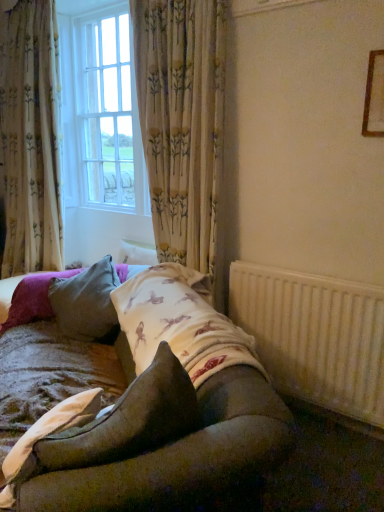
Describe the element at coordinates (30, 138) in the screenshot. This screenshot has width=384, height=512. I see `floral fabric curtain at left, the first curtain positioned from the left` at that location.

At what (x,y) coordinates should I click in order to perform the action: click on velvet gray pillow at center, which is the 1th pillow from back to front. Please return your answer as a coordinate pair (x, y). This screenshot has height=512, width=384. Looking at the image, I should click on (87, 303).

Locate an element on the screen. Image resolution: width=384 pixels, height=512 pixels. textured beige quilt at lower left is located at coordinates (49, 375).

You are a GUI agent. You are given a task and a screenshot of the screen. Output one action in this format:
    pyautogui.click(x=<x>, y=<y>)
    Task: Click on the wooden frame at upper right
    The width and height of the screenshot is (384, 512).
    Given the screenshot: What is the action you would take?
    pyautogui.click(x=374, y=96)

Describe the element at coordinates (315, 336) in the screenshot. Image resolution: width=384 pixels, height=512 pixels. I see `white textured radiator at lower right` at that location.

Where is `floral fabric curtain at left, arranged as the second curtain when viewed from the right`? The image size is (384, 512). floral fabric curtain at left, arranged as the second curtain when viewed from the right is located at coordinates (30, 138).

Considering the sizes of velvet gray pillow at center, which is the 1th pillow from back to front, and textured beige quilt at lower left in the image, is velvet gray pillow at center, which is the 1th pillow from back to front, bigger or smaller than textured beige quilt at lower left?

Clearly, velvet gray pillow at center, which is the 1th pillow from back to front, is larger in size than textured beige quilt at lower left.

Considering the relative positions of velvet gray pillow at center, which ranks as the second pillow in front-to-back order, and textured beige quilt at lower left in the image provided, is velvet gray pillow at center, which ranks as the second pillow in front-to-back order, behind textured beige quilt at lower left?

Yes, velvet gray pillow at center, which ranks as the second pillow in front-to-back order, is further from the camera.

Is velvet gray pillow at center, which ranks as the second pillow in front-to-back order, wider or thinner than textured beige quilt at lower left?

velvet gray pillow at center, which ranks as the second pillow in front-to-back order, is wider than textured beige quilt at lower left.

Relative to white textured radiator at lower right, is textured beige quilt at lower left in front or behind?

Clearly, textured beige quilt at lower left is in front of white textured radiator at lower right.

Is the surface of textured beige quilt at lower left in direct contact with white textured radiator at lower right?

textured beige quilt at lower left is not next to white textured radiator at lower right, and they're not touching.

How far apart are textured beige quilt at lower left and white textured radiator at lower right?

textured beige quilt at lower left and white textured radiator at lower right are 1.01 meters apart from each other.

From a real-world perspective, is wooden frame at upper right located beneath velvet gray pillow at center, which is the 1th pillow from back to front?

No, from a real-world perspective, wooden frame at upper right is not under velvet gray pillow at center, which is the 1th pillow from back to front.

Consider the image. Does wooden frame at upper right have a smaller size compared to velvet gray pillow at center, which ranks as the second pillow in front-to-back order?

Indeed, wooden frame at upper right has a smaller size compared to velvet gray pillow at center, which ranks as the second pillow in front-to-back order.

Is wooden frame at upper right oriented away from velvet gray pillow at center, which is the 1th pillow from back to front?

wooden frame at upper right does not have its back to velvet gray pillow at center, which is the 1th pillow from back to front.

Is floral fabric curtain at left, the first curtain positioned from the left, inside the boundaries of velvet brown pillow at center, arranged as the first pillow when viewed from the front, or outside?

floral fabric curtain at left, the first curtain positioned from the left, is spatially situated outside velvet brown pillow at center, arranged as the first pillow when viewed from the front.

From the image's perspective, is floral fabric curtain at left, the first curtain positioned from the left, located above or below velvet brown pillow at center, arranged as the first pillow when viewed from the front?

floral fabric curtain at left, the first curtain positioned from the left, is above velvet brown pillow at center, arranged as the first pillow when viewed from the front.

In the image, is floral fabric curtain at left, arranged as the second curtain when viewed from the right, on the left side or the right side of velvet brown pillow at center, arranged as the first pillow when viewed from the front?

Clearly, floral fabric curtain at left, arranged as the second curtain when viewed from the right, is on the left of velvet brown pillow at center, arranged as the first pillow when viewed from the front, in the image.

Could you tell me if floral fabric curtain at left, the first curtain positioned from the left, is facing velvet brown pillow at center, arranged as the first pillow when viewed from the front?

No, floral fabric curtain at left, the first curtain positioned from the left, is not turned towards velvet brown pillow at center, arranged as the first pillow when viewed from the front.

From the picture: Is wooden frame at upper right outside of floral fabric curtain at center, which is the second curtain in left-to-right order?

Absolutely, wooden frame at upper right is external to floral fabric curtain at center, which is the second curtain in left-to-right order.

Who is shorter, wooden frame at upper right or floral fabric curtain at center, which is the second curtain in left-to-right order?

Standing shorter between the two is wooden frame at upper right.

Is wooden frame at upper right positioned with its back to floral fabric curtain at center, arranged as the first curtain when viewed from the right?

No, wooden frame at upper right is not facing away from floral fabric curtain at center, arranged as the first curtain when viewed from the right.

Considering the sizes of objects floral fabric curtain at center, arranged as the first curtain when viewed from the right, and textured beige quilt at lower left in the image provided, who is wider, floral fabric curtain at center, arranged as the first curtain when viewed from the right, or textured beige quilt at lower left?

With larger width is textured beige quilt at lower left.

Between floral fabric curtain at center, arranged as the first curtain when viewed from the right, and textured beige quilt at lower left, which one has smaller size?

textured beige quilt at lower left.

Which of these two, floral fabric curtain at center, which is the second curtain in left-to-right order, or textured beige quilt at lower left, stands taller?

Standing taller between the two is floral fabric curtain at center, which is the second curtain in left-to-right order.

Is point (164, 260) in front of point (34, 354)?

That is False.

Does floral fabric curtain at center, arranged as the first curtain when viewed from the right, have a smaller size compared to wooden frame at upper right?

Actually, floral fabric curtain at center, arranged as the first curtain when viewed from the right, might be larger than wooden frame at upper right.

Is floral fabric curtain at center, which is the second curtain in left-to-right order, to the right of wooden frame at upper right from the viewer's perspective?

No.

Considering the sizes of objects floral fabric curtain at center, arranged as the first curtain when viewed from the right, and wooden frame at upper right in the image provided, who is taller, floral fabric curtain at center, arranged as the first curtain when viewed from the right, or wooden frame at upper right?

floral fabric curtain at center, arranged as the first curtain when viewed from the right.

From a real-world perspective, which is physically below, floral fabric curtain at center, arranged as the first curtain when viewed from the right, or wooden frame at upper right?

floral fabric curtain at center, arranged as the first curtain when viewed from the right, is physically lower.

Where is `the 2nd pillow above when counting from the textured beige quilt at lower left (from the image's perspective)`? The image size is (384, 512). the 2nd pillow above when counting from the textured beige quilt at lower left (from the image's perspective) is located at coordinates (87, 303).

You are a GUI agent. You are given a task and a screenshot of the screen. Output one action in this format:
    pyautogui.click(x=<x>, y=<y>)
    Task: Click on the quilt that appears below the white textured radiator at lower right (from the image's perspective)
    
    Given the screenshot: What is the action you would take?
    pyautogui.click(x=49, y=375)

When comparing their distances from wooden frame at upper right, does white textured radiator at lower right or velvet gray pillow at center, which ranks as the second pillow in front-to-back order, seem closer?

white textured radiator at lower right is positioned closer to the anchor wooden frame at upper right.

Based on their spatial positions, is white textured radiator at lower right or floral fabric curtain at left, the first curtain positioned from the left, further from wooden frame at upper right?

floral fabric curtain at left, the first curtain positioned from the left.

When comparing their distances from floral fabric curtain at center, arranged as the first curtain when viewed from the right, does white textured radiator at lower right or wooden frame at upper right seem further?

Based on the image, wooden frame at upper right appears to be further to floral fabric curtain at center, arranged as the first curtain when viewed from the right.

Consider the image. Based on their spatial positions, is wooden frame at upper right or white textured radiator at lower right further from floral fabric curtain at left, arranged as the second curtain when viewed from the right?

Among the two, wooden frame at upper right is located further to floral fabric curtain at left, arranged as the second curtain when viewed from the right.

Estimate the real-world distances between objects in this image. Which object is closer to wooden frame at upper right, textured beige quilt at lower left or velvet brown pillow at center, the 2th pillow viewed from the back?

velvet brown pillow at center, the 2th pillow viewed from the back.

From the image, which object appears to be farther from floral fabric curtain at center, which is the second curtain in left-to-right order, velvet gray pillow at center, which ranks as the second pillow in front-to-back order, or floral fabric curtain at left, the first curtain positioned from the left?

floral fabric curtain at left, the first curtain positioned from the left, lies further to floral fabric curtain at center, which is the second curtain in left-to-right order, than the other object.

Based on their spatial positions, is white glass window at upper left or white textured radiator at lower right closer to floral fabric curtain at left, the first curtain positioned from the left?

white glass window at upper left.

When comparing their distances from white glass window at upper left, does floral fabric curtain at left, arranged as the second curtain when viewed from the right, or floral fabric curtain at center, which is the second curtain in left-to-right order, seem further?

floral fabric curtain at center, which is the second curtain in left-to-right order, is positioned further to the anchor white glass window at upper left.

Locate an element on the screen. curtain located between velvet brown pillow at center, the 2th pillow viewed from the back, and velvet gray pillow at center, which ranks as the second pillow in front-to-back order, in the depth direction is located at coordinates (183, 128).

Where is `pillow between white glass window at upper left and velvet brown pillow at center, arranged as the first pillow when viewed from the front, in the up-down direction`? The image size is (384, 512). pillow between white glass window at upper left and velvet brown pillow at center, arranged as the first pillow when viewed from the front, in the up-down direction is located at coordinates (87, 303).

Where is `window between velvet brown pillow at center, arranged as the first pillow when viewed from the front, and floral fabric curtain at left, the first curtain positioned from the left, in the front-back direction`? The height and width of the screenshot is (512, 384). window between velvet brown pillow at center, arranged as the first pillow when viewed from the front, and floral fabric curtain at left, the first curtain positioned from the left, in the front-back direction is located at coordinates (101, 112).

Where is `curtain positioned between textured beige quilt at lower left and floral fabric curtain at left, arranged as the second curtain when viewed from the right, from near to far`? curtain positioned between textured beige quilt at lower left and floral fabric curtain at left, arranged as the second curtain when viewed from the right, from near to far is located at coordinates (183, 128).